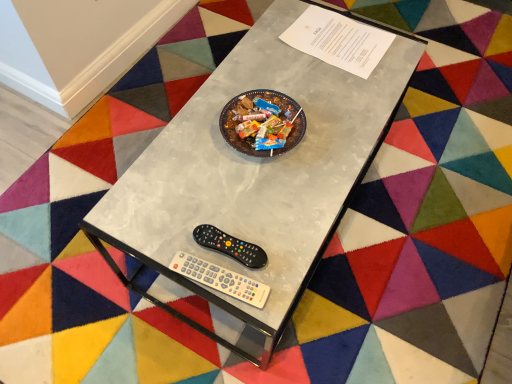
Where is `vacant space situated on the left part of black plastic remote at lower center`? vacant space situated on the left part of black plastic remote at lower center is located at coordinates (155, 223).